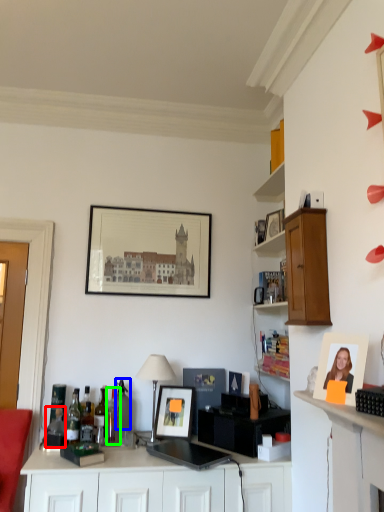
Question: Which is nearer to the bottle (highlighted by a red box)? bottle (highlighted by a blue box) or bottle (highlighted by a green box).

Choices:
 (A) bottle
 (B) bottle

Answer: (B)